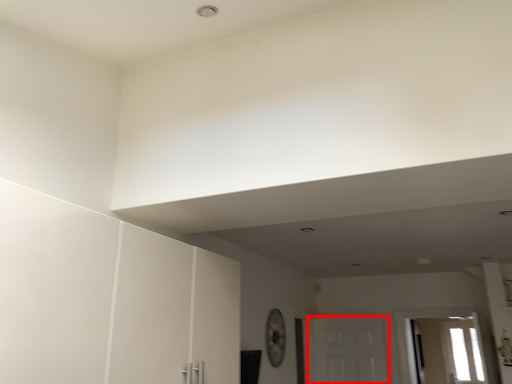
Question: From the image's perspective, where is door (annotated by the red box) located in relation to window in the image?

Choices:
 (A) below
 (B) above

Answer: (B)